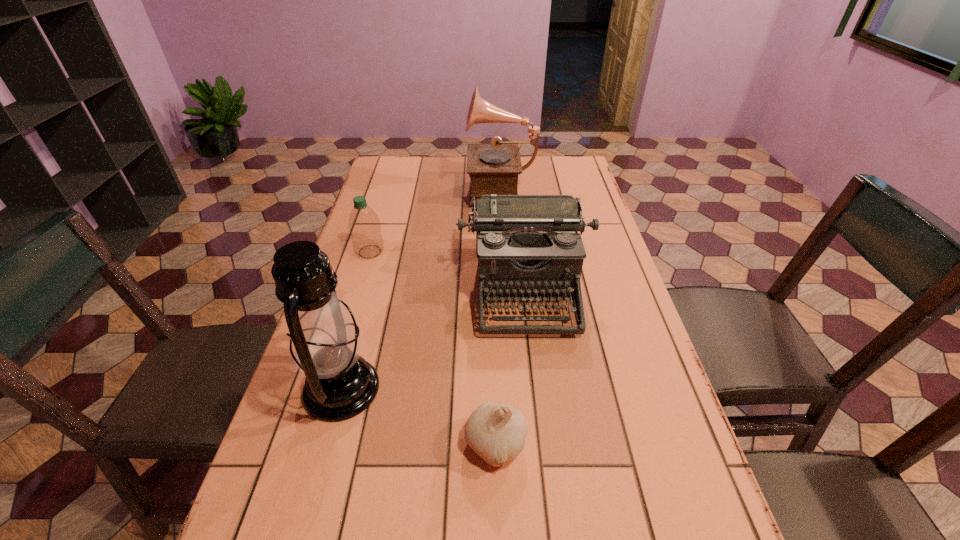
Where is `vacant space situated on the back of the second shortest object`? This screenshot has height=540, width=960. vacant space situated on the back of the second shortest object is located at coordinates (378, 224).

Locate an element on the screen. vacant space situated 0.230m on the back of the shortest object is located at coordinates (492, 332).

I want to click on object present at the far edge, so click(x=493, y=169).

This screenshot has height=540, width=960. I want to click on oil lamp that is at the left edge, so click(325, 343).

In order to click on water bottle that is positioned at the left edge in this screenshot , I will do `click(364, 225)`.

This screenshot has height=540, width=960. Identify the location of object located in the right edge section of the desktop. (525, 244).

The image size is (960, 540). Find the location of `free space at the far edge of the desktop`. free space at the far edge of the desktop is located at coordinates (526, 176).

In the image, there is a desktop. At what (x,y) coordinates should I click in order to perform the action: click on vacant space at the left edge. Please return your answer as a coordinate pair (x, y). This screenshot has height=540, width=960. Looking at the image, I should click on (374, 349).

The width and height of the screenshot is (960, 540). In the image, there is a desktop. In order to click on free space at the right edge in this screenshot , I will do click(x=649, y=377).

Find the location of a particular element. Image resolution: width=960 pixels, height=540 pixels. vacant region between the farthest object and the water bottle is located at coordinates (436, 220).